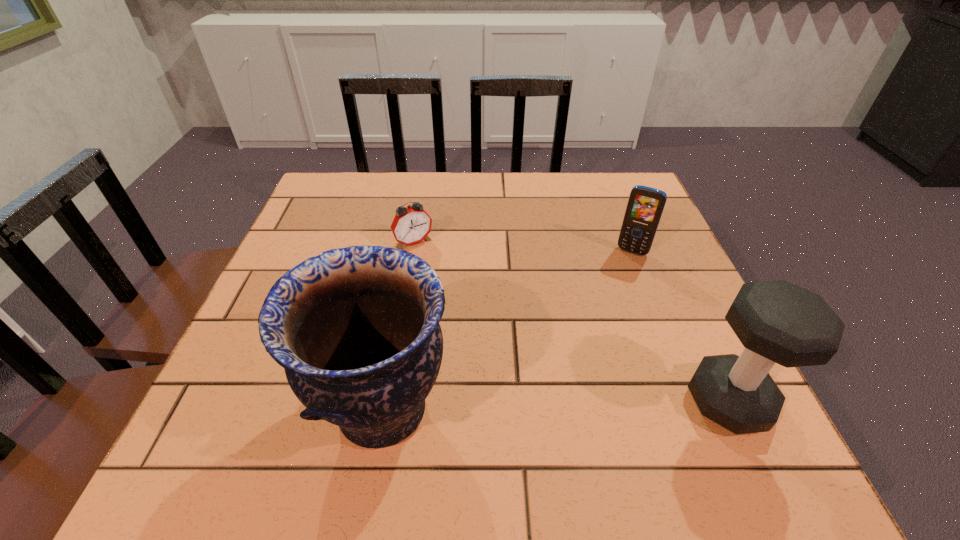
The height and width of the screenshot is (540, 960). I want to click on vacant space at the near edge of the desktop, so click(644, 380).

Find the location of a particular element. The image size is (960, 540). vacant space at the left edge of the desktop is located at coordinates (340, 230).

The width and height of the screenshot is (960, 540). I want to click on free space at the right edge of the desktop, so click(666, 234).

Image resolution: width=960 pixels, height=540 pixels. Find the location of `free spot at the far left corner of the desktop`. free spot at the far left corner of the desktop is located at coordinates (340, 193).

Locate an element on the screen. free location at the near left corner of the desktop is located at coordinates (272, 406).

This screenshot has height=540, width=960. I want to click on vacant space at the far right corner, so click(636, 179).

Identify the location of blank region between the shortest object and the third tallest object. (523, 247).

Where is `vacant area that lies between the dumbbell and the cellular telephone`? The height and width of the screenshot is (540, 960). vacant area that lies between the dumbbell and the cellular telephone is located at coordinates (681, 327).

What are the coordinates of `free space between the second shortest object and the pottery` in the screenshot? It's located at (508, 330).

The image size is (960, 540). I want to click on free space between the dumbbell and the second shortest object, so click(681, 327).